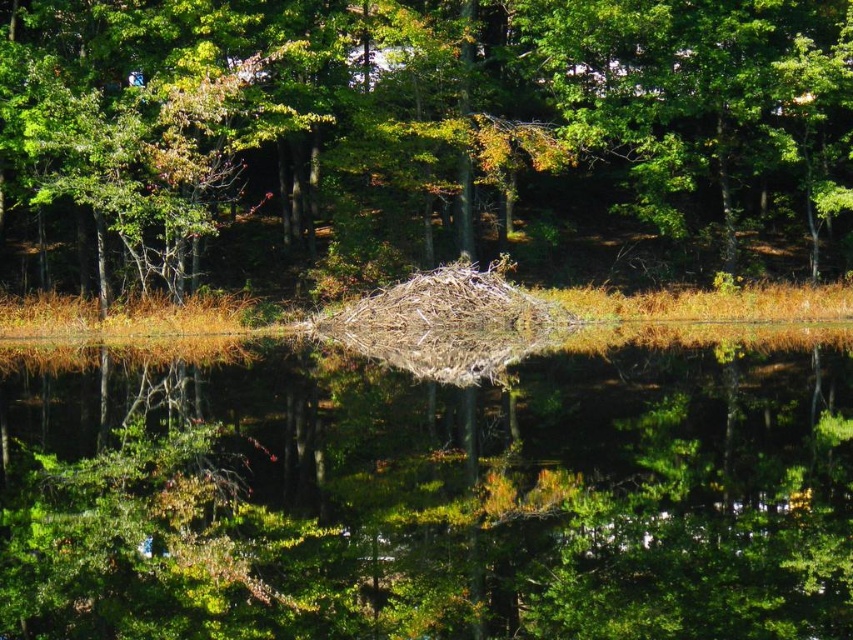
Question: Which object is farther from the camera taking this photo?

Choices:
 (A) brown textured water at center
 (B) brown textured nest at center

Answer: (B)

Question: Which of the following is the farthest from the observer?

Choices:
 (A) (552, 520)
 (B) (244, 8)

Answer: (B)

Question: Is brown textured nest at center further to the viewer compared to brown textured water at center?

Choices:
 (A) yes
 (B) no

Answer: (A)

Question: Can you confirm if brown textured nest at center is wider than brown textured water at center?

Choices:
 (A) no
 (B) yes

Answer: (B)

Question: Does brown textured nest at center have a greater width compared to brown textured water at center?

Choices:
 (A) yes
 (B) no

Answer: (A)

Question: Which of the following is the farthest from the observer?

Choices:
 (A) (531, 458)
 (B) (438, 42)

Answer: (B)